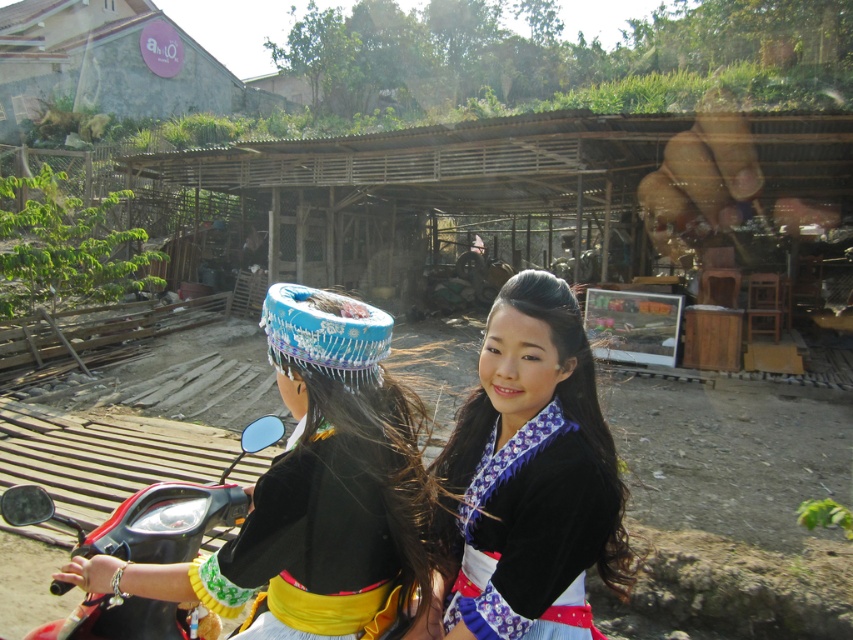
You are a photographer trying to capture a clear photo of both the matte black kimono at center and the shiny black motorcycle at center. Since the kimono is larger than the motorcycle, which object should you focus on first to ensure both are in frame?

The matte black kimono at center is bigger than the shiny black motorcycle at center, so you should focus on the matte black kimono at center first to ensure it fits within the frame, then adjust to include the motorcycle.